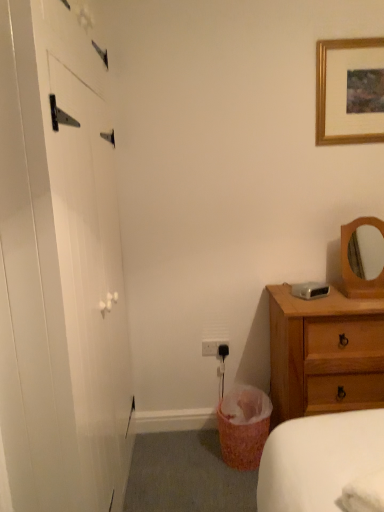
Locate an element on the screen. pink woven laundry basket at lower center is located at coordinates (243, 426).

What do you see at coordinates (324, 354) in the screenshot?
I see `wooden chest of drawers at right` at bounding box center [324, 354].

In order to click on pink woven laundry basket at lower center in this screenshot , I will do `click(243, 426)`.

Does white plastic electric outlet at lower center appear on the right side of pink woven laundry basket at lower center?

No, white plastic electric outlet at lower center is not to the right of pink woven laundry basket at lower center.

Can you confirm if white plastic electric outlet at lower center is wider than pink woven laundry basket at lower center?

No.

Is white plastic electric outlet at lower center positioned with its back to pink woven laundry basket at lower center?

white plastic electric outlet at lower center is not turned away from pink woven laundry basket at lower center.

Which of these two, white plastic electric outlet at lower center or pink woven laundry basket at lower center, stands shorter?

With less height is white plastic electric outlet at lower center.

From a real-world perspective, which object rests below the other?

white plastic electric outlet at lower center.

From the image's perspective, is white plastic electric outlet at lower center above gold wooden picture frame at upper right?

Actually, white plastic electric outlet at lower center appears below gold wooden picture frame at upper right in the image.

Is the position of white plastic electric outlet at lower center more distant than that of gold wooden picture frame at upper right?

Yes, the depth of white plastic electric outlet at lower center is greater than that of gold wooden picture frame at upper right.

Which object is wider, white plastic electric outlet at lower center or gold wooden picture frame at upper right?

gold wooden picture frame at upper right is wider.

Based on the photo, which of these two, gold wooden picture frame at upper right or white plastic electric outlet at lower center, stands shorter?

white plastic electric outlet at lower center.

Is gold wooden picture frame at upper right positioned far away from white plastic electric outlet at lower center?

Yes, gold wooden picture frame at upper right is far from white plastic electric outlet at lower center.

Which is nearer, (333,99) or (210,352)?

The point (333,99) is in front.

Which object is positioned more to the left, gold wooden picture frame at upper right or white plastic electric outlet at lower center?

white plastic electric outlet at lower center.

Who is more distant, white matte barn door at left or pink woven laundry basket at lower center?

pink woven laundry basket at lower center is behind.

Considering the points (65, 15) and (241, 411), which point is behind, point (65, 15) or point (241, 411)?

Point (241, 411)

Is white matte barn door at left not inside pink woven laundry basket at lower center?

Indeed, white matte barn door at left is completely outside pink woven laundry basket at lower center.

Is white matte barn door at left oriented towards pink woven laundry basket at lower center?

Yes.

In the scene shown: Between wooden chest of drawers at right and white plastic electric outlet at lower center, which one is positioned behind?

white plastic electric outlet at lower center is more distant.

Considering the relative positions of wooden chest of drawers at right and white plastic electric outlet at lower center in the image provided, is wooden chest of drawers at right to the left or to the right of white plastic electric outlet at lower center?

wooden chest of drawers at right is to the right of white plastic electric outlet at lower center.

From a real-world perspective, is wooden chest of drawers at right located beneath white plastic electric outlet at lower center?

Yes, from a real-world perspective, wooden chest of drawers at right is below white plastic electric outlet at lower center.

Which of these two, gold wooden picture frame at upper right or pink woven laundry basket at lower center, is bigger?

Bigger between the two is pink woven laundry basket at lower center.

Does gold wooden picture frame at upper right lie behind pink woven laundry basket at lower center?

Yes, gold wooden picture frame at upper right is further from the viewer.

Are gold wooden picture frame at upper right and pink woven laundry basket at lower center beside each other?

No, gold wooden picture frame at upper right is not next to pink woven laundry basket at lower center.

Is gold wooden picture frame at upper right taller or shorter than pink woven laundry basket at lower center?

Clearly, gold wooden picture frame at upper right is taller compared to pink woven laundry basket at lower center.

From a real-world perspective, is white plastic electric outlet at lower center beneath white matte barn door at left?

Correct, in the physical world, white plastic electric outlet at lower center is lower than white matte barn door at left.

Consider the image. Who is taller, white plastic electric outlet at lower center or white matte barn door at left?

Standing taller between the two is white matte barn door at left.

Looking at their sizes, would you say white plastic electric outlet at lower center is wider or thinner than white matte barn door at left?

In the image, white plastic electric outlet at lower center appears to be more narrow than white matte barn door at left.

Is white plastic electric outlet at lower center completely or partially outside of white matte barn door at left?

Absolutely, white plastic electric outlet at lower center is external to white matte barn door at left.

Image resolution: width=384 pixels, height=512 pixels. What are the coordinates of `electric outlet behind the pink woven laundry basket at lower center` in the screenshot? It's located at (215, 348).

The height and width of the screenshot is (512, 384). What are the coordinates of `picture frame above the white plastic electric outlet at lower center (from a real-world perspective)` in the screenshot? It's located at (350, 91).

Which object lies nearer to the anchor point gold wooden picture frame at upper right, white matte barn door at left or white plastic electric outlet at lower center?

white plastic electric outlet at lower center.

Estimate the real-world distances between objects in this image. Which object is closer to white plastic electric outlet at lower center, white matte barn door at left or wooden chest of drawers at right?

Among the two, wooden chest of drawers at right is located nearer to white plastic electric outlet at lower center.

Which object lies further to the anchor point pink woven laundry basket at lower center, white plastic electric outlet at lower center or wooden chest of drawers at right?

white plastic electric outlet at lower center is further to pink woven laundry basket at lower center.

Based on the photo, estimate the real-world distances between objects in this image. Which object is closer to wooden chest of drawers at right, white plastic electric outlet at lower center or pink woven laundry basket at lower center?

pink woven laundry basket at lower center lies closer to wooden chest of drawers at right than the other object.

Which object lies further to the anchor point gold wooden picture frame at upper right, wooden chest of drawers at right or white matte barn door at left?

white matte barn door at left.

Based on their spatial positions, is white matte barn door at left or pink woven laundry basket at lower center further from wooden chest of drawers at right?

white matte barn door at left.

When comparing their distances from pink woven laundry basket at lower center, does white matte barn door at left or white plastic electric outlet at lower center seem closer?

The object closer to pink woven laundry basket at lower center is white plastic electric outlet at lower center.

Looking at the image, which one is located closer to white matte barn door at left, pink woven laundry basket at lower center or white plastic electric outlet at lower center?

pink woven laundry basket at lower center is closer to white matte barn door at left.

You are a GUI agent. You are given a task and a screenshot of the screen. Output one action in this format:
    pyautogui.click(x=<x>, y=<y>)
    Task: Click on the chest of drawers between gold wooden picture frame at upper right and pink woven laundry basket at lower center vertically
    This screenshot has width=384, height=512.
    Given the screenshot: What is the action you would take?
    pyautogui.click(x=324, y=354)

You are a GUI agent. You are given a task and a screenshot of the screen. Output one action in this format:
    pyautogui.click(x=<x>, y=<y>)
    Task: Click on the chest of drawers between white matte barn door at left and white plastic electric outlet at lower center from front to back
    This screenshot has width=384, height=512.
    Given the screenshot: What is the action you would take?
    pyautogui.click(x=324, y=354)

At what (x,y) coordinates should I click in order to perform the action: click on electric outlet between gold wooden picture frame at upper right and wooden chest of drawers at right in the vertical direction. Please return your answer as a coordinate pair (x, y). This screenshot has height=512, width=384. Looking at the image, I should click on (215, 348).

Find the location of `picture frame between white matte barn door at left and white plastic electric outlet at lower center along the z-axis`. picture frame between white matte barn door at left and white plastic electric outlet at lower center along the z-axis is located at coordinates (350, 91).